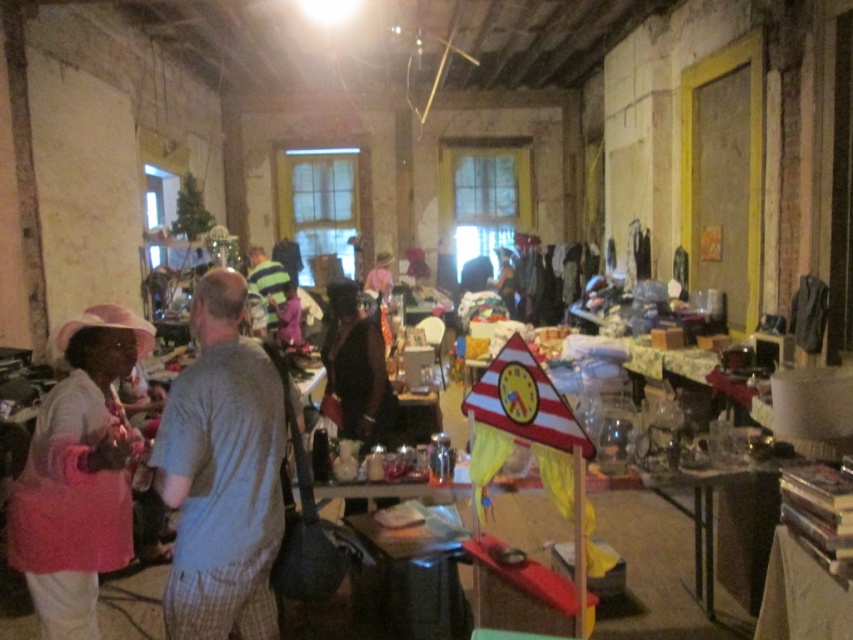
Consider the image. You are helping organize the flea market and need to determine if the gray cotton shirt at center can fit into a storage box that is the same size as the brown leather jacket at center. Can it fit?

The gray cotton shirt at center is smaller than the brown leather jacket at center, so it can fit into the storage box that is the same size as the brown leather jacket at center.

You are helping organize the flea market and need to decide if the gray cotton shirt at center can fit into a storage box that is the same size as the pink fabric apron at left. Based on their sizes, will it fit?

The gray cotton shirt at center has a smaller size compared to the pink fabric apron at left, so it should fit into a box sized for the apron.

You are a customer at the flea market and want to buy both the pink fabric apron at left and the brown leather jacket at center. Which item should you approach first if you are standing at the entrance facing the tables?

The pink fabric apron at left is to the left of the brown leather jacket at center, so you should approach the pink fabric apron at left first since it is closer to your left side when facing the tables.